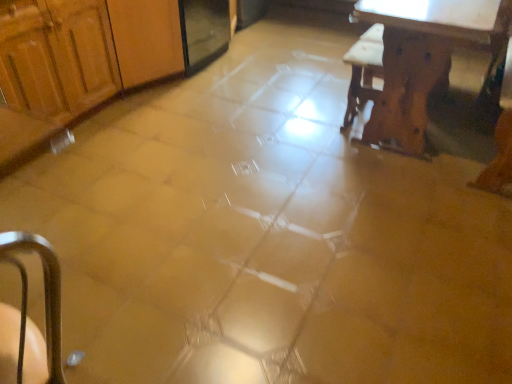
Describe the element at coordinates (57, 56) in the screenshot. I see `wooden cabinet at left` at that location.

Locate an element on the screen. Image resolution: width=512 pixels, height=384 pixels. wooden cabinet at left is located at coordinates (57, 56).

Find the location of a particular element. wooden table at upper right is located at coordinates (422, 58).

Image resolution: width=512 pixels, height=384 pixels. Describe the element at coordinates (422, 58) in the screenshot. I see `wooden table at upper right` at that location.

Identify the location of wooden cabinet at left. This screenshot has height=384, width=512. (57, 56).

Is wooden cabinet at left at the right side of wooden table at upper right?

No, wooden cabinet at left is not to the right of wooden table at upper right.

Is wooden cabinet at left further to the viewer compared to wooden table at upper right?

Yes, the depth of wooden cabinet at left is greater than that of wooden table at upper right.

Which is in front, point (34, 38) or point (496, 14)?

Positioned in front is point (34, 38).

From the image's perspective, would you say wooden cabinet at left is shown under wooden table at upper right?

No.

Consider the image. From a real-world perspective, is wooden cabinet at left positioned above or below wooden table at upper right?

In terms of real-world spatial position, wooden cabinet at left is above wooden table at upper right.

Between wooden cabinet at left and wooden table at upper right, which one has smaller width?

Thinner between the two is wooden cabinet at left.

Which of these two, wooden cabinet at left or wooden table at upper right, stands taller?

wooden cabinet at left is taller.

Considering the relative sizes of wooden cabinet at left and wooden table at upper right in the image provided, is wooden cabinet at left smaller than wooden table at upper right?

Yes.

Is wooden cabinet at left completely or partially outside of wooden table at upper right?

That's correct, wooden cabinet at left is outside of wooden table at upper right.

Is wooden cabinet at left touching wooden table at upper right?

They are not placed beside each other.

Is wooden cabinet at left oriented towards wooden table at upper right?

Yes, wooden cabinet at left is turned towards wooden table at upper right.

The image size is (512, 384). Identify the location of cabinetry behind the wooden table at upper right. (57, 56).

Considering the relative positions of wooden table at upper right and wooden cabinet at left in the image provided, is wooden table at upper right to the left of wooden cabinet at left from the viewer's perspective?

Incorrect, wooden table at upper right is not on the left side of wooden cabinet at left.

Is the position of wooden table at upper right less distant than that of wooden cabinet at left?

Yes.

Is point (395, 118) positioned in front of point (31, 98)?

No, it is not.

Based on the photo, from the image's perspective, is wooden table at upper right located above or below wooden cabinet at left?

Based on their image positions, wooden table at upper right is located beneath wooden cabinet at left.

From a real-world perspective, is wooden table at upper right physically located above or below wooden cabinet at left?

In terms of real-world spatial position, wooden table at upper right is below wooden cabinet at left.

Considering the sizes of objects wooden table at upper right and wooden cabinet at left in the image provided, who is thinner, wooden table at upper right or wooden cabinet at left?

Thinner between the two is wooden cabinet at left.

In terms of height, does wooden table at upper right look taller or shorter compared to wooden cabinet at left?

wooden table at upper right is shorter than wooden cabinet at left.

Is wooden table at upper right bigger than wooden cabinet at left?

Correct, wooden table at upper right is larger in size than wooden cabinet at left.

Is wooden cabinet at left inside wooden table at upper right?

No, wooden table at upper right does not contain wooden cabinet at left.

From the picture: Would you say wooden table at upper right is a long distance from wooden cabinet at left?

wooden table at upper right is positioned a significant distance from wooden cabinet at left.

Is wooden table at upper right facing away from wooden cabinet at left?

No.

How many degrees apart are the facing directions of wooden table at upper right and wooden cabinet at left?

90.5 degrees separate the facing orientations of wooden table at upper right and wooden cabinet at left.

This screenshot has width=512, height=384. I want to click on cabinetry positioned vertically above the wooden table at upper right (from a real-world perspective), so click(57, 56).

The height and width of the screenshot is (384, 512). Identify the location of table located underneath the wooden cabinet at left (from a real-world perspective). (422, 58).

The image size is (512, 384). There is a wooden table at upper right. Identify the location of cabinetry above it (from a real-world perspective). (57, 56).